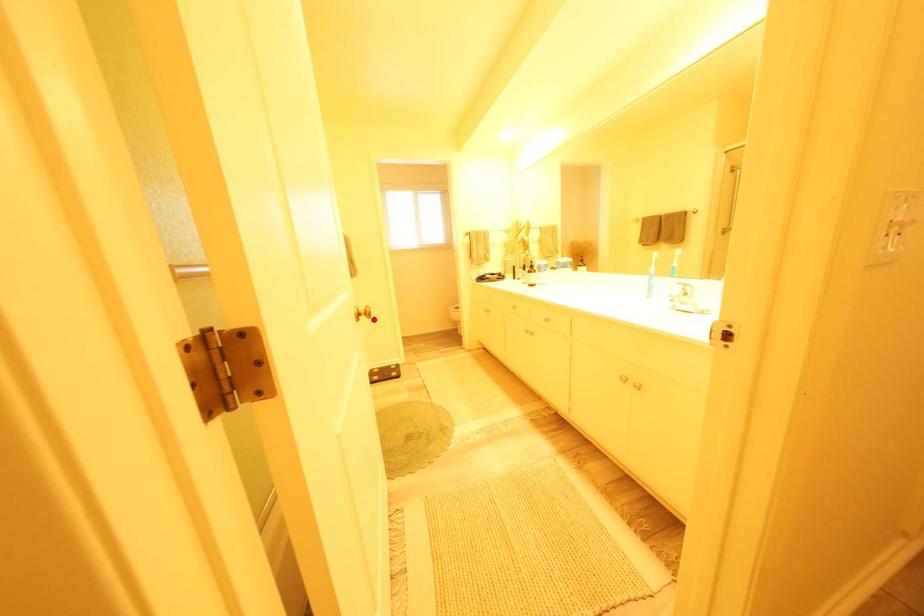
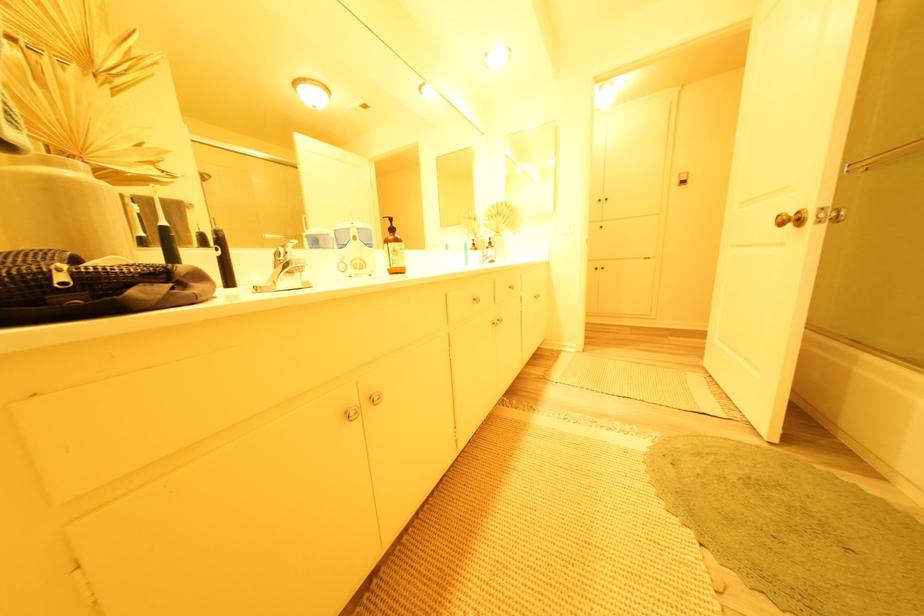
In the second image, find the point that corresponds to the highlighted location in the first image.

(801, 227)